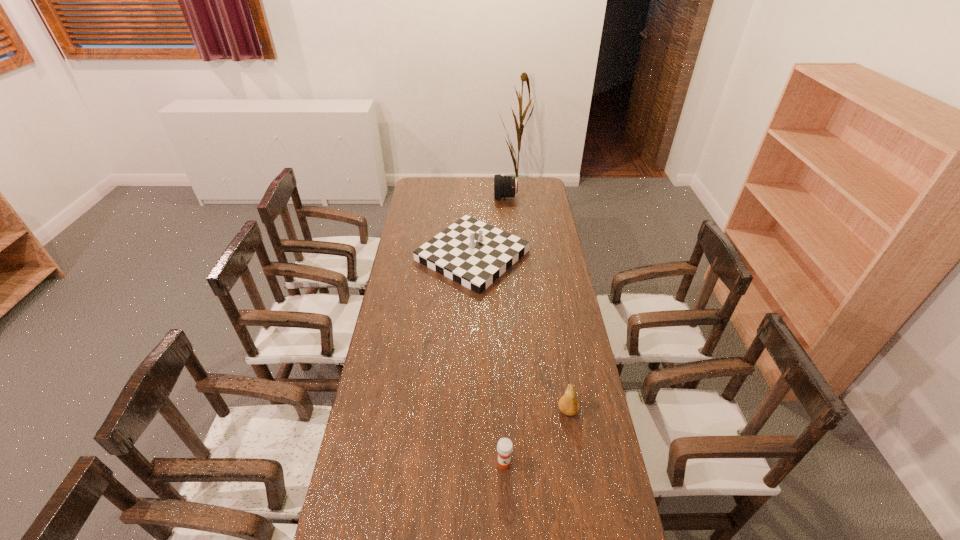
Locate an element on the screen. Image resolution: width=960 pixels, height=540 pixels. the farthest object is located at coordinates (504, 186).

Where is `checkerboard`? The height and width of the screenshot is (540, 960). checkerboard is located at coordinates (470, 252).

Where is `the third farthest object`? The image size is (960, 540). the third farthest object is located at coordinates (568, 404).

This screenshot has height=540, width=960. I want to click on the rightmost object, so click(x=568, y=404).

The image size is (960, 540). I want to click on medicine, so pyautogui.click(x=505, y=446).

At what (x,y) coordinates should I click in order to perform the action: click on free space located 0.050m at the front element of the telephoto lens. Please return your answer as a coordinate pair (x, y). The height and width of the screenshot is (540, 960). Looking at the image, I should click on (485, 198).

I want to click on free spot located at the front element of the telephoto lens, so click(x=433, y=198).

I want to click on free space located 0.150m at the front element of the telephoto lens, so click(x=468, y=198).

Where is `free space located on the front of the checkerboard`? The width and height of the screenshot is (960, 540). free space located on the front of the checkerboard is located at coordinates (470, 369).

At what (x,y) coordinates should I click in order to perform the action: click on blank space located 0.300m on the back of the third farthest object. Please return your answer as a coordinate pair (x, y). Looking at the image, I should click on (555, 334).